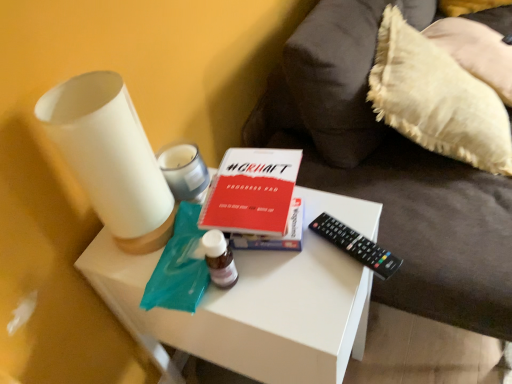
You are a GUI agent. You are given a task and a screenshot of the screen. Output one action in this format:
    pyautogui.click(x=<x>, y=<y>)
    Task: Click on the vacant area on top of red matte progress pad at center (from a real-world perspective)
    The width and height of the screenshot is (512, 384).
    Given the screenshot: What is the action you would take?
    pyautogui.click(x=251, y=188)